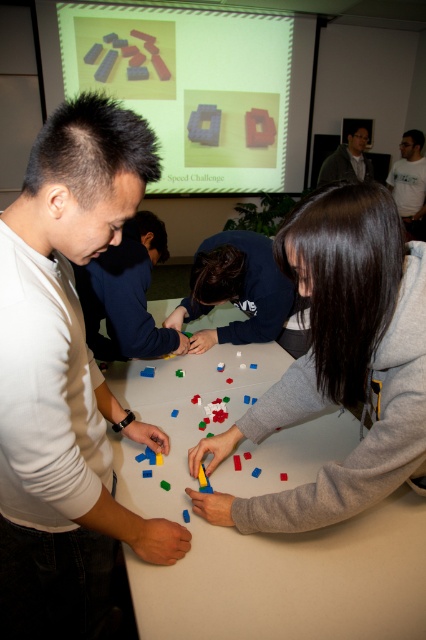
You are a participant in the LEGO challenge and need to place a large LEGO baseplate on the table. The baseplate is as wide as the blue fabric shirt at center. Will it fit on the white matte table at center?

The white matte table at center might be wider than blue fabric shirt at center, so the baseplate, which is as wide as the blue fabric shirt at center, should fit on the table.

What is located at the coordinates point (x=126, y=294)?

The location at point (x=126, y=294) has a matte white shirt at center.